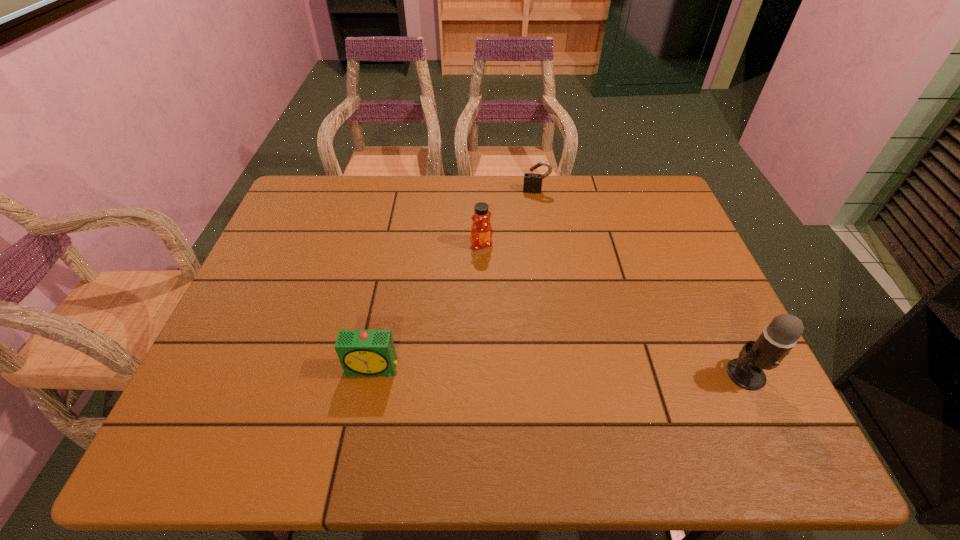
This screenshot has width=960, height=540. In order to click on free space on the desktop that is between the alarm clock and the microphone and is positioned on the front label of the second object from left to right in this screenshot , I will do `click(563, 371)`.

The image size is (960, 540). What are the coordinates of `vacant spot on the desktop that is between the alarm clock and the microphone and is positioned with the keyhole on the front of the farthest object` in the screenshot? It's located at point(525,370).